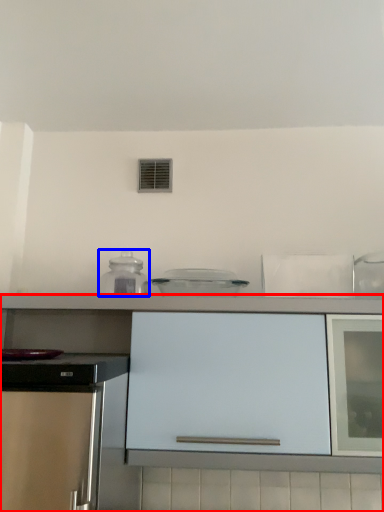
Question: Which of the following is the farthest to the observer, cabinetry (highlighted by a red box) or kitchen appliance (highlighted by a blue box)?

Choices:
 (A) cabinetry
 (B) kitchen appliance

Answer: (B)